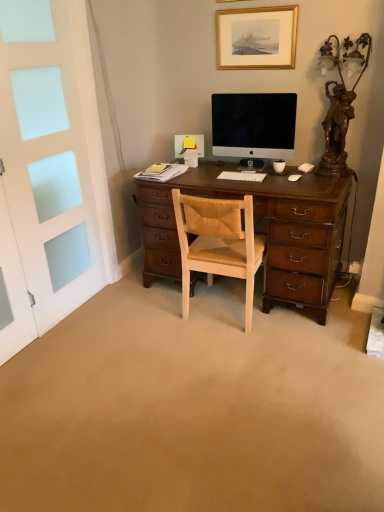
Question: Is gold-framed picture at upper center not inside satin black monitor at center?

Choices:
 (A) no
 (B) yes

Answer: (B)

Question: Could satin black monitor at center be considered to be inside gold-framed picture at upper center?

Choices:
 (A) no
 (B) yes

Answer: (A)

Question: Does gold-framed picture at upper center turn towards satin black monitor at center?

Choices:
 (A) no
 (B) yes

Answer: (A)

Question: Are gold-framed picture at upper center and satin black monitor at center making contact?

Choices:
 (A) no
 (B) yes

Answer: (A)

Question: Is gold-framed picture at upper center at the right side of satin black monitor at center?

Choices:
 (A) yes
 (B) no

Answer: (A)

Question: From the image's perspective, would you say gold-framed picture at upper center is shown under satin black monitor at center?

Choices:
 (A) no
 (B) yes

Answer: (A)

Question: Is white matte computer mouse at center-right, the second computer mouse when ordered from top to bottom, thinner than light brown leather chair at center?

Choices:
 (A) yes
 (B) no

Answer: (A)

Question: Is light brown leather chair at center at the back of white matte computer mouse at center-right, the 1th computer mouse in the bottom-to-top sequence?

Choices:
 (A) no
 (B) yes

Answer: (A)

Question: From the image's perspective, would you say white matte computer mouse at center-right, the 1th computer mouse in the bottom-to-top sequence, is positioned over light brown leather chair at center?

Choices:
 (A) no
 (B) yes

Answer: (B)

Question: Is white matte computer mouse at center-right, the 1th computer mouse positioned from the left, not inside light brown leather chair at center?

Choices:
 (A) no
 (B) yes

Answer: (B)

Question: Can you confirm if white matte computer mouse at center-right, placed as the first computer mouse when sorted from front to back, is smaller than light brown leather chair at center?

Choices:
 (A) yes
 (B) no

Answer: (A)

Question: From the image's perspective, is white matte computer mouse at center-right, positioned as the second computer mouse in back-to-front order, below light brown leather chair at center?

Choices:
 (A) yes
 (B) no

Answer: (B)

Question: Is gold-framed picture at upper center positioned with its back to white frosted glass screen door at left?

Choices:
 (A) yes
 (B) no

Answer: (B)